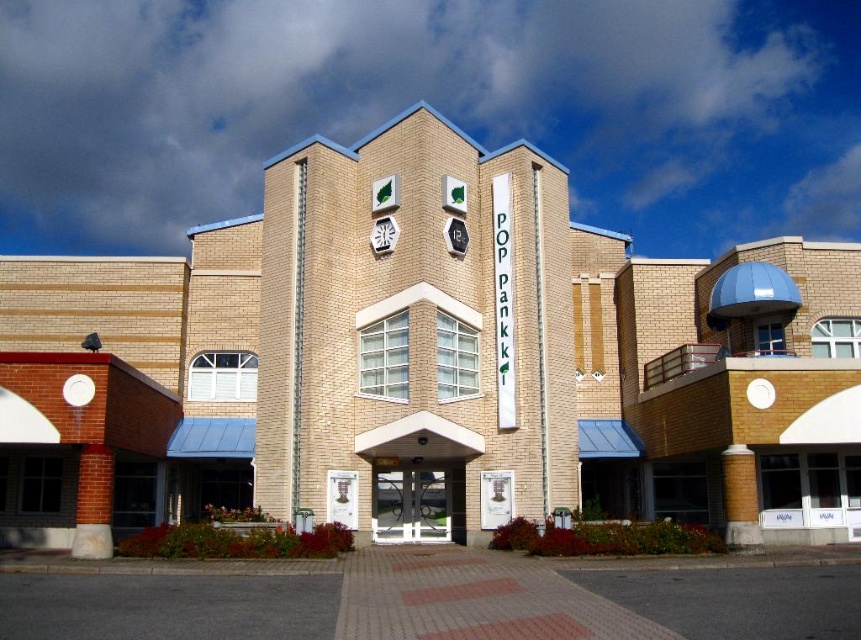
Who is positioned more to the left, metallic hexagonal clock at center or metallic hexagon at center?

metallic hexagonal clock at center is more to the left.

How much distance is there between metallic hexagonal clock at center and metallic hexagon at center?

metallic hexagonal clock at center is 3.56 meters away from metallic hexagon at center.

Is point (387, 244) behind point (462, 248)?

No, (387, 244) is closer to viewer.

Where is `metallic hexagonal clock at center`? The image size is (861, 640). metallic hexagonal clock at center is located at coordinates (383, 234).